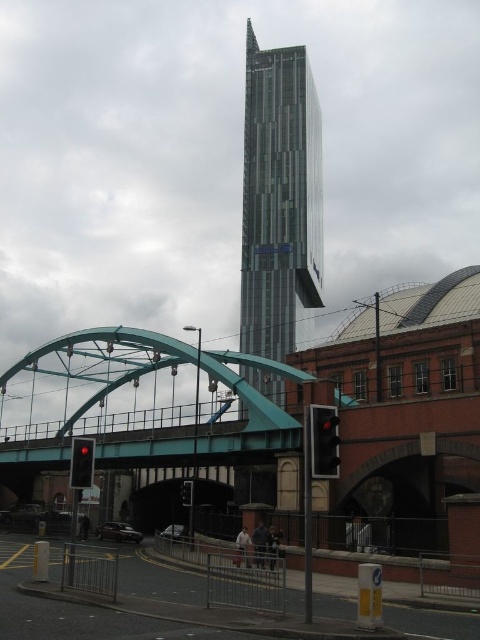
Is glassy steel tower at center closer to the viewer compared to matte black traffic light at center?

No.

Is glassy steel tower at center wider than matte black traffic light at center?

Yes.

Locate an element on the screen. The image size is (480, 640). glassy steel tower at center is located at coordinates (279, 198).

Locate an element on the screen. glassy steel tower at center is located at coordinates (279, 198).

Is matte black traffic light at center shorter than black plastic traffic light at lower center?

Yes.

Does matte black traffic light at center have a lesser width compared to black plastic traffic light at lower center?

Yes.

Is point (328, 440) positioned before point (187, 492)?

That is True.

Locate an element on the screen. matte black traffic light at center is located at coordinates (324, 442).

Is glassy steel tower at center positioned behind black plastic traffic light at lower center?

Yes.

Is glassy steel tower at center below black plastic traffic light at lower center?

Actually, glassy steel tower at center is above black plastic traffic light at lower center.

This screenshot has height=640, width=480. I want to click on glassy steel tower at center, so (x=279, y=198).